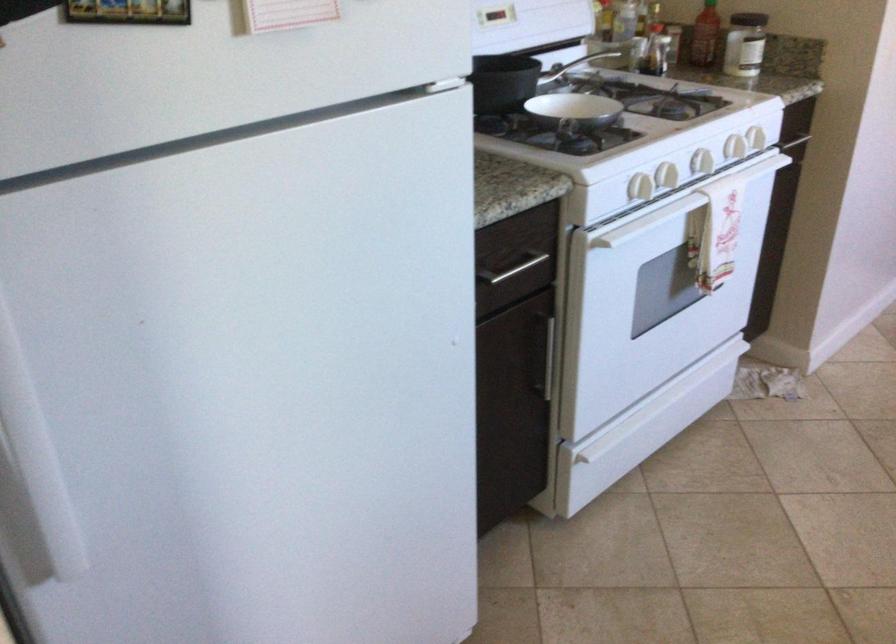
Locate an element on the screen. This screenshot has height=644, width=896. white pan handle is located at coordinates (567, 128).